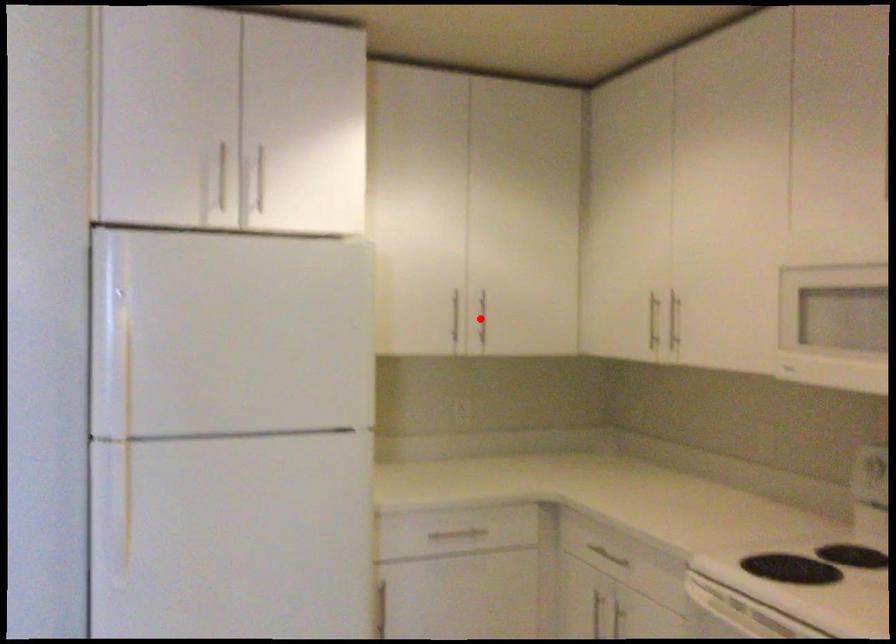
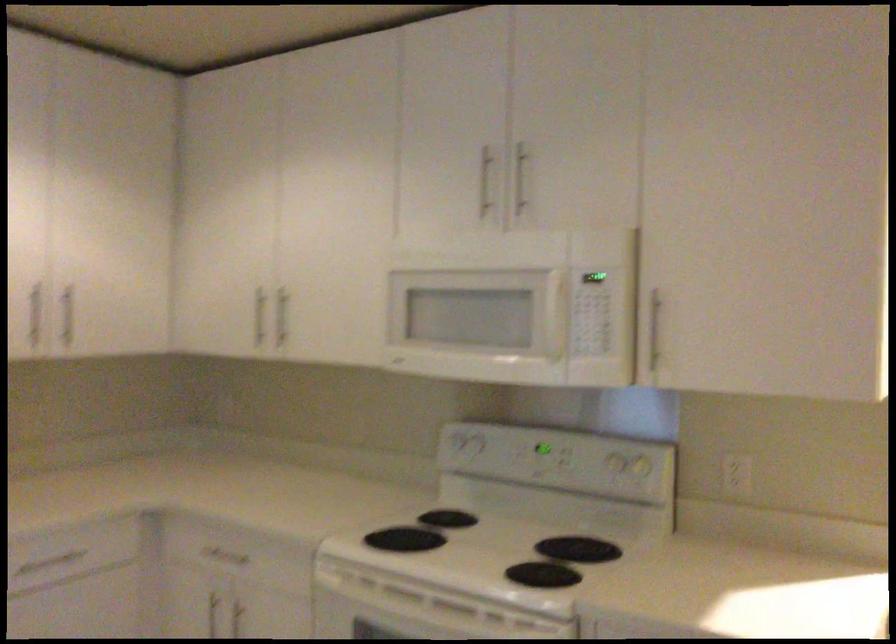
Where in the second image is the point corresponding to the highlighted location from the first image?

(66, 316)